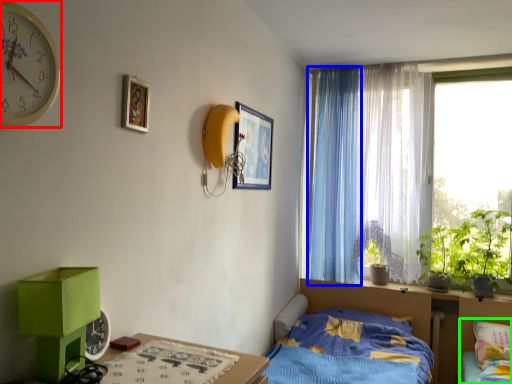
Question: Estimate the real-world distances between objects in this image. Which object is farther from clock (highlighted by a red box), curtain (highlighted by a blue box) or bed (highlighted by a green box)?

Choices:
 (A) curtain
 (B) bed

Answer: (B)